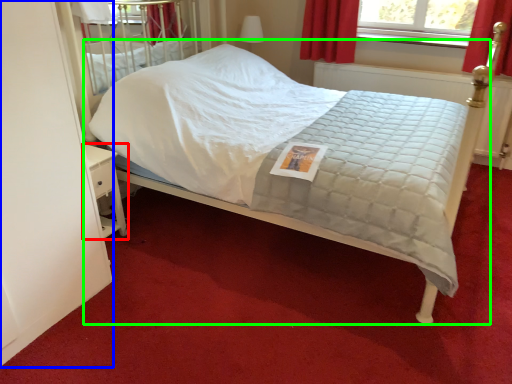
Question: Which object is positioned farthest from nightstand (highlighted by a red box)? Select from screen door (highlighted by a blue box) and bed (highlighted by a green box).

Choices:
 (A) screen door
 (B) bed

Answer: (B)